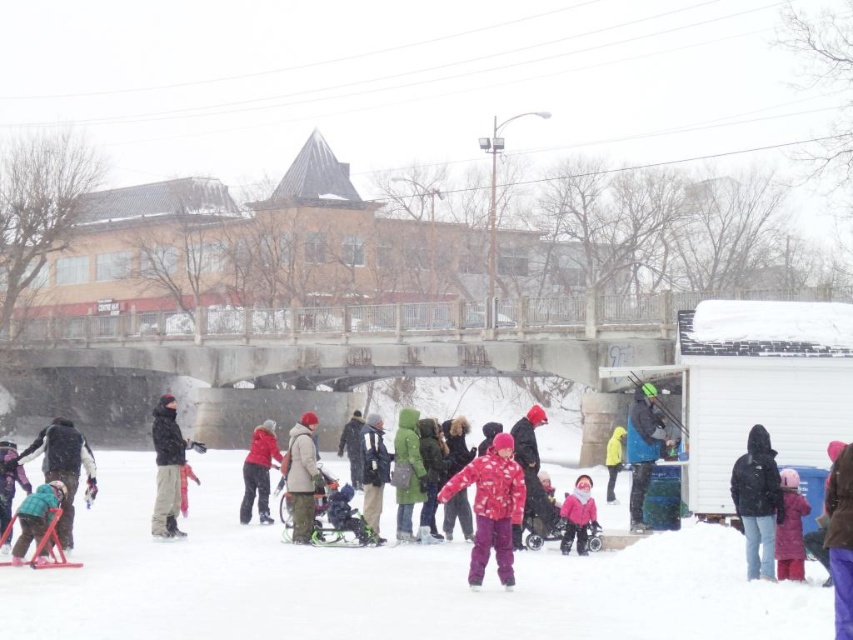
Question: In this image, where is green fuzzy jacket at lower left located relative to matte pink snowsuit at lower center?

Choices:
 (A) below
 (B) above

Answer: (A)

Question: Which object is positioned farthest from the green matte jacket at center?

Choices:
 (A) brushed metal snowboard at lower left
 (B) green fabric jacket at center
 (C) fluffy pink snowsuit at center

Answer: (A)

Question: Is brown fuzzy coat at lower right further to the viewer compared to matte pink snowsuit at lower right?

Choices:
 (A) no
 (B) yes

Answer: (A)

Question: Which of the following is the closest to the observer?

Choices:
 (A) fluffy pink snowsuit at center
 (B) matte beige coat at center

Answer: (A)

Question: Does fluffy pink snowsuit at center have a greater width compared to matte pink snowsuit at center?

Choices:
 (A) no
 (B) yes

Answer: (B)

Question: Among these points, which one is farthest from the camera?

Choices:
 (A) (379, 634)
 (B) (16, 454)
 (C) (741, 468)

Answer: (B)